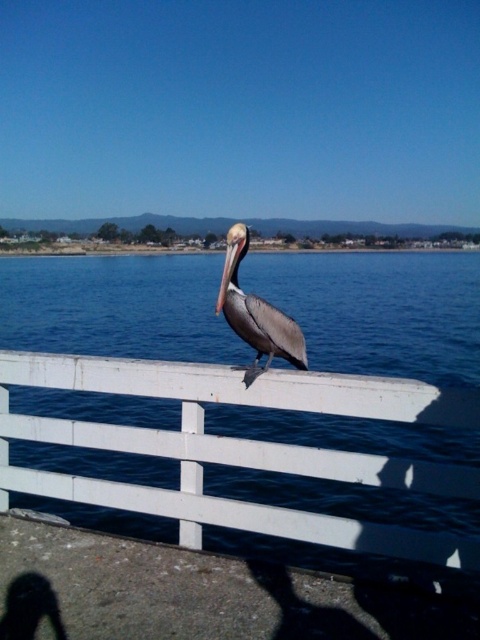
From the picture: You are standing in front of the coastal scene and want to touch the white painted wood at center and the brown matte pelican at center. Which object can you reach first without moving your position?

The white painted wood at center is closer to the viewer than the brown matte pelican at center, so you can reach the white painted wood at center first.

You are a birdwatcher standing at the edge of the coast. You see the white painted wood at center and the brown matte pelican at center. How far apart are these two objects from each other?

The white painted wood at center is 3.34 feet away from the brown matte pelican at center.

You are a birdwatcher trying to observe the brown matte pelican at center from behind the white painted wood at center. Can you see the entire pelican clearly without any obstruction?

The brown matte pelican at center is taller than the white painted wood at center, so yes, you can see the entire pelican clearly without any obstruction.